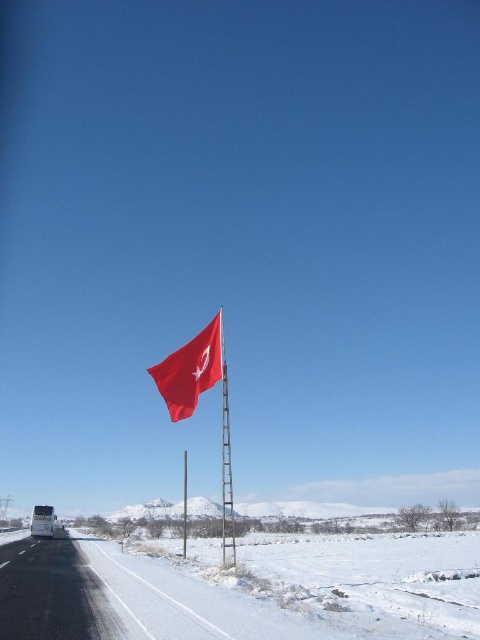
Which is in front, point (131, 628) or point (202, 355)?

Point (131, 628) is in front.

Identify the location of black asphalt highway at lower left. (124, 598).

How far apart are black asphalt highway at lower left and metallic silver flag pole at center?

159.79 feet

Is point (43, 588) farther from viewer compared to point (230, 552)?

No.

Describe the element at coordinates (124, 598) in the screenshot. I see `black asphalt highway at lower left` at that location.

Locate an element on the screen. This screenshot has width=480, height=640. black asphalt highway at lower left is located at coordinates (124, 598).

Does matte red flag at center appear over metallic silver flag pole at center?

Correct, matte red flag at center is located above metallic silver flag pole at center.

Is matte red flag at center smaller than metallic silver flag pole at center?

Actually, matte red flag at center might be larger than metallic silver flag pole at center.

Image resolution: width=480 pixels, height=640 pixels. Find the location of `matte red flag at center`. matte red flag at center is located at coordinates (191, 371).